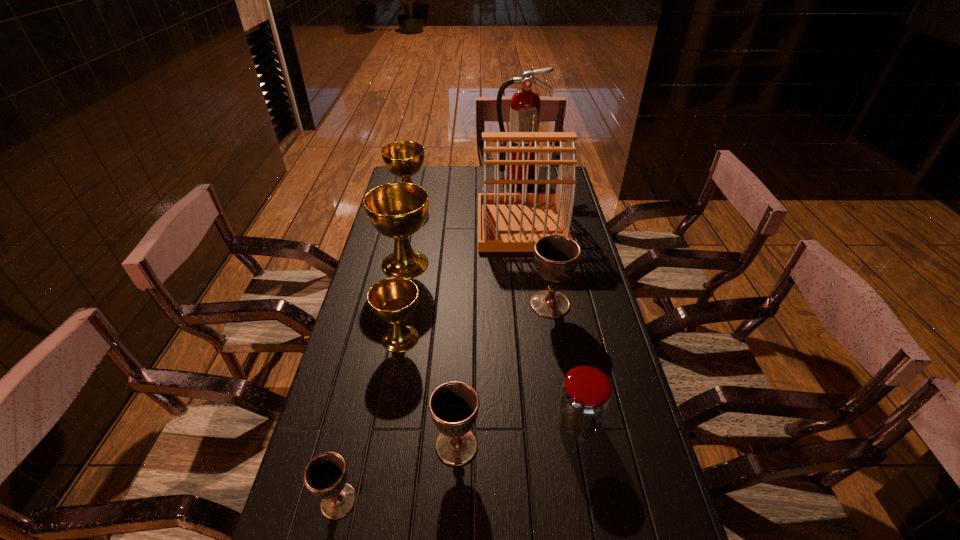
At what (x,y) coordinates should I click in order to perform the action: click on vacant position located on the right of the third tallest object. Please return your answer as a coordinate pair (x, y). Looking at the image, I should click on (491, 264).

In order to click on vacant space located on the back of the second smallest gold chalice in this screenshot , I will do `click(414, 176)`.

What are the coordinates of `vacant space located on the front of the rightmost brown chalice` in the screenshot? It's located at (558, 347).

You are a GUI agent. You are given a task and a screenshot of the screen. Output one action in this format:
    pyautogui.click(x=<x>, y=<y>)
    Task: Click on the free space located on the back of the second nearest chalice
    The height and width of the screenshot is (540, 960).
    Given the screenshot: What is the action you would take?
    pyautogui.click(x=462, y=331)

Find the location of a particular element. This screenshot has width=960, height=540. free space located 0.370m on the right of the nearest gold chalice is located at coordinates (548, 338).

Identify the location of vacant area situated on the left of the red jar. The width and height of the screenshot is (960, 540). (439, 424).

Where is `vacant space located 0.330m on the back of the nearest object`? The image size is (960, 540). vacant space located 0.330m on the back of the nearest object is located at coordinates tap(371, 363).

Where is `fire extinguisher that is at the far edge`? This screenshot has width=960, height=540. fire extinguisher that is at the far edge is located at coordinates (525, 103).

This screenshot has width=960, height=540. Identify the location of chalice present at the far edge. (404, 159).

The image size is (960, 540). In order to click on fire extinguisher present at the right edge in this screenshot , I will do `click(525, 103)`.